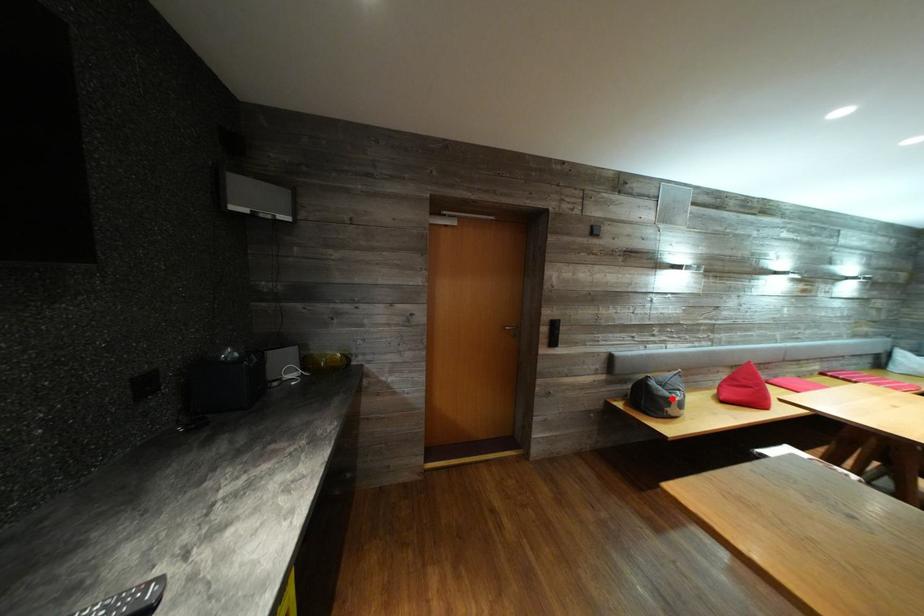
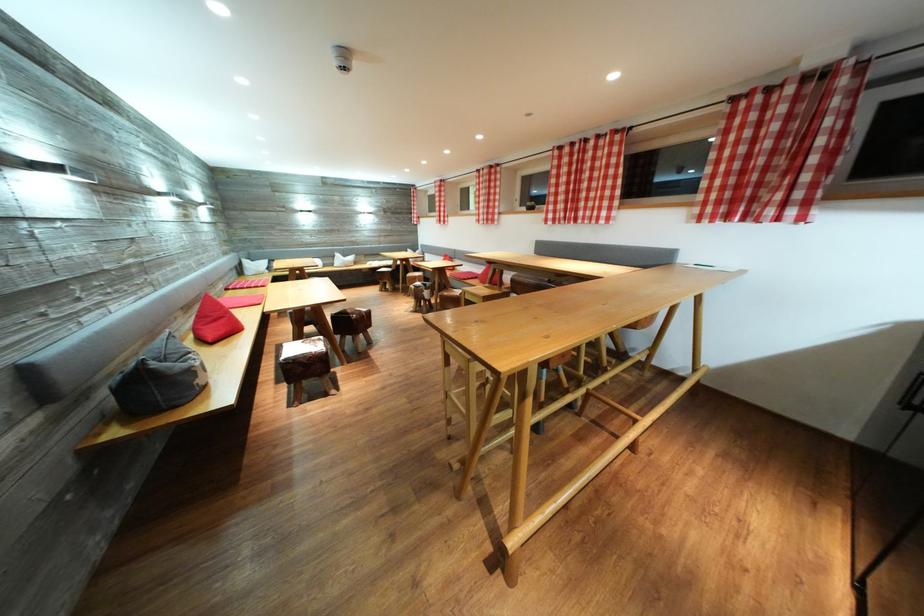
Where in the second image is the point corresponding to the highlighted location from the first image?

(187, 371)